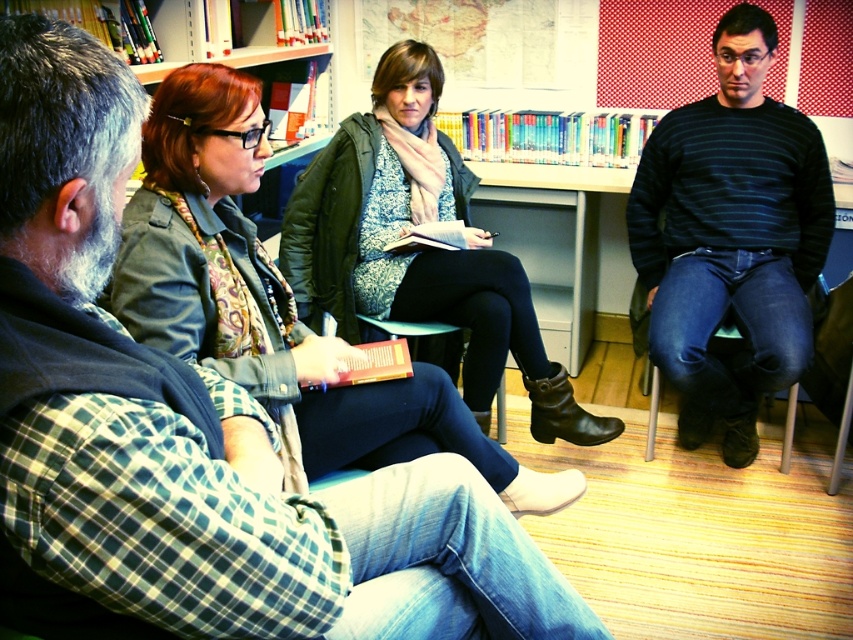
You are a visitor entering the library and notice two jackets in the scene. Which jacket, the matte green jacket at upper left or the matte black jacket at center, is positioned lower in the image?

The matte green jacket at upper left is positioned below the matte black jacket at center, so the matte green jacket at upper left is lower in the image.

You are a delivery person who needs to place a package between the matte green jacket at upper left and the matte black jacket at center. The package is 30 inches long. Can you fit it between them without moving either jacket?

The distance between the matte green jacket at upper left and the matte black jacket at center is 28.75 inches. Since the package is 30 inches long, it cannot fit between them without moving either jacket.